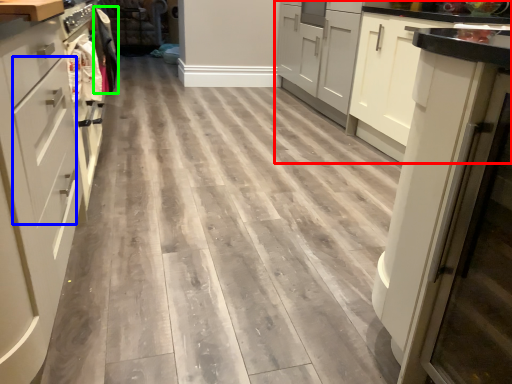
Question: Estimate the real-world distances between objects in this image. Which object is farther from cabinetry (highlighted by a red box), drawer (highlighted by a blue box) or laundry (highlighted by a green box)?

Choices:
 (A) drawer
 (B) laundry

Answer: (A)